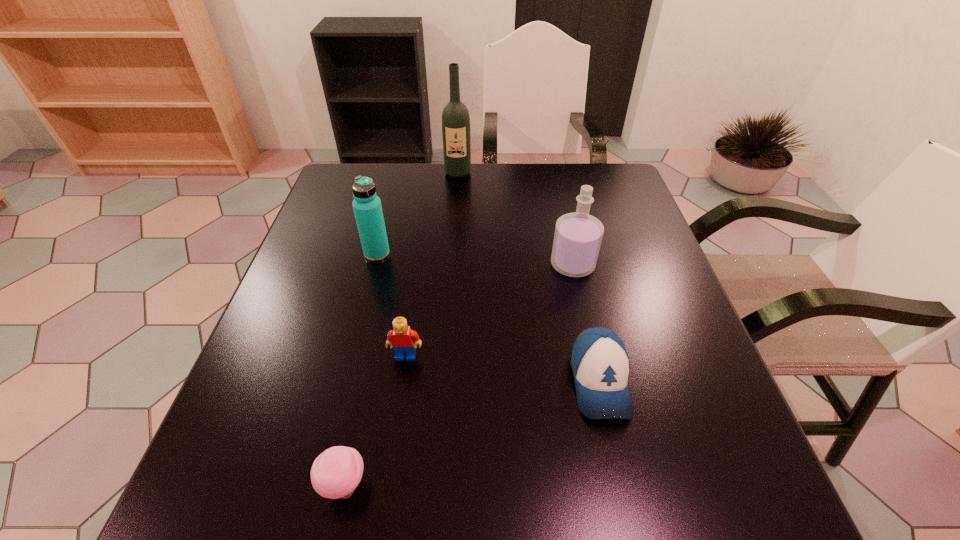
The height and width of the screenshot is (540, 960). Identify the location of vacant area between the nearest object and the water bottle. (361, 370).

What are the coordinates of `free space between the Lego and the cupcake` in the screenshot? It's located at (375, 421).

The image size is (960, 540). What are the coordinates of `object that is the fifth closest to the water bottle` in the screenshot? It's located at (335, 473).

Choose which object is the third nearest neighbor to the perfume. Please provide its 2D coordinates. Your answer should be formatted as a tuple, i.e. [(x, y)], where the tuple contains the x and y coordinates of a point satisfying the conditions above.

[(455, 117)]

Image resolution: width=960 pixels, height=540 pixels. Identify the location of free location that satisfies the following two spatial constraints: 1. on the labeled side of the third object from right to left; 2. on the right side of the perfume. (451, 265).

This screenshot has height=540, width=960. Find the location of `free region that satisfies the following two spatial constraints: 1. on the front side of the perfume; 2. on the right side of the water bottle`. free region that satisfies the following two spatial constraints: 1. on the front side of the perfume; 2. on the right side of the water bottle is located at coordinates (374, 265).